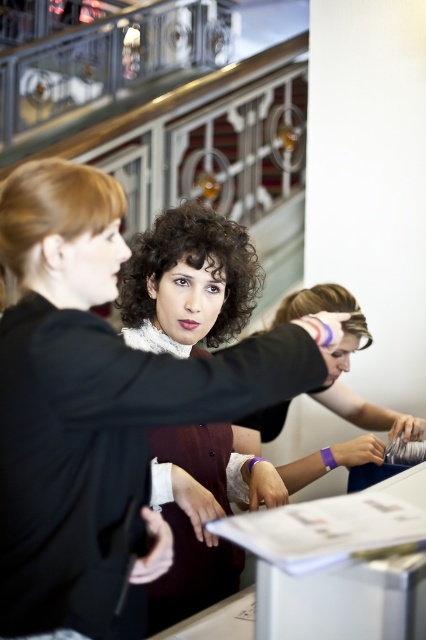
From the picture: Can you confirm if purple fabric wristband at center is wider than blonde hair at left?

Yes, purple fabric wristband at center is wider than blonde hair at left.

Can you confirm if purple fabric wristband at center is thinner than blonde hair at left?

Incorrect, purple fabric wristband at center's width is not less than blonde hair at left's.

What do you see at coordinates (359, 396) in the screenshot? I see `purple fabric wristband at center` at bounding box center [359, 396].

You are a GUI agent. You are given a task and a screenshot of the screen. Output one action in this format:
    pyautogui.click(x=<x>, y=<y>)
    Task: Click on the purple fabric wristband at center
    
    Given the screenshot: What is the action you would take?
    pyautogui.click(x=359, y=396)

Is point (227, 316) positioned behind point (5, 266)?

Yes, point (227, 316) is farther from viewer.

Between curly brown hair at center and blonde hair at left, which one is positioned higher?

blonde hair at left is above.

Is point (227, 326) less distant than point (57, 164)?

No, (227, 326) is further to viewer.

The height and width of the screenshot is (640, 426). Identify the location of curly brown hair at center. (192, 276).

From the picture: Does matte black jacket at center appear under curly brown hair at center?

Yes.

Between matte black jacket at center and curly brown hair at center, which one has more height?

matte black jacket at center is taller.

Where is `matte black jacket at center`? This screenshot has height=640, width=426. matte black jacket at center is located at coordinates (97, 408).